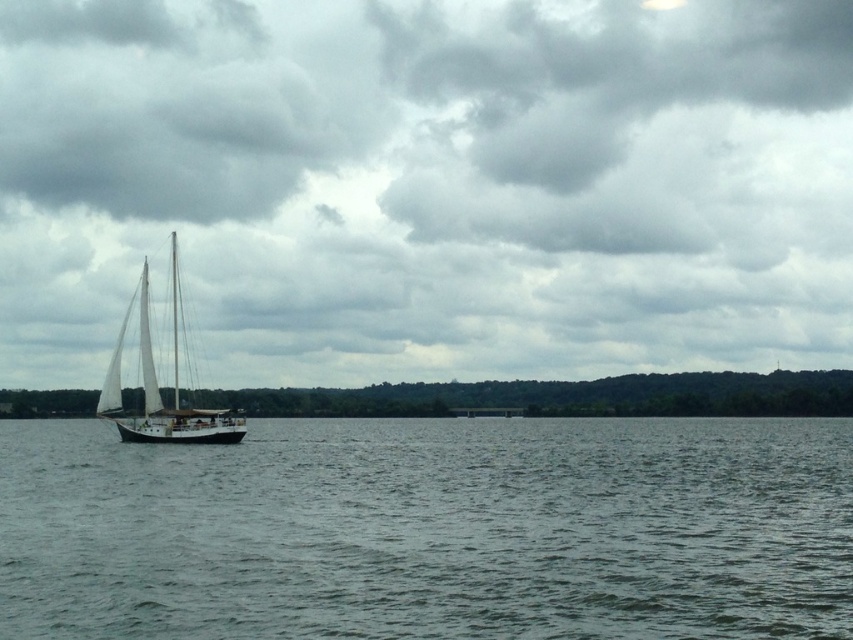
Looking at this image, you are an observer standing on the lakeside. You see the gray water at center and the white matte sailboat at left. Which object covers a wider area in the image?

The gray water at center covers a wider area in the image because its width is larger than that of the white matte sailboat at left.

You are standing on the lakeside and want to know if the gray water at center is taller than the white matte sailboat at left. Can you confirm this based on the scene?

The gray water at center has a greater height compared to the white matte sailboat at left, so yes, the gray water at center is taller than the white matte sailboat at left.